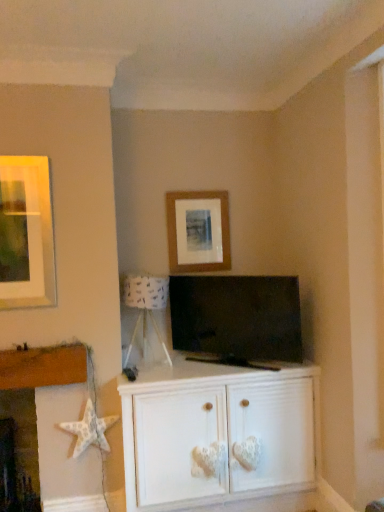
Question: Is white painted wood cabinet at center not within wooden picture frame at center?

Choices:
 (A) no
 (B) yes

Answer: (B)

Question: Does white painted wood cabinet at center have a greater width compared to wooden picture frame at center?

Choices:
 (A) no
 (B) yes

Answer: (B)

Question: Does white painted wood cabinet at center have a lesser width compared to wooden picture frame at center?

Choices:
 (A) yes
 (B) no

Answer: (B)

Question: Does white painted wood cabinet at center have a greater height compared to wooden picture frame at center?

Choices:
 (A) yes
 (B) no

Answer: (A)

Question: Is the depth of white painted wood cabinet at center greater than that of wooden picture frame at center?

Choices:
 (A) yes
 (B) no

Answer: (B)

Question: Is the surface of white painted wood cabinet at center in direct contact with wooden picture frame at center?

Choices:
 (A) no
 (B) yes

Answer: (A)

Question: Is white textured star at lower left shorter than white painted wood cabinet at center?

Choices:
 (A) no
 (B) yes

Answer: (A)

Question: Is white textured star at lower left touching white painted wood cabinet at center?

Choices:
 (A) no
 (B) yes

Answer: (A)

Question: From the image's perspective, is white textured star at lower left on white painted wood cabinet at center?

Choices:
 (A) yes
 (B) no

Answer: (A)

Question: Considering the relative sizes of white textured star at lower left and white painted wood cabinet at center in the image provided, is white textured star at lower left thinner than white painted wood cabinet at center?

Choices:
 (A) yes
 (B) no

Answer: (A)

Question: Considering the relative sizes of white textured star at lower left and white painted wood cabinet at center in the image provided, is white textured star at lower left bigger than white painted wood cabinet at center?

Choices:
 (A) no
 (B) yes

Answer: (A)

Question: Considering the relative sizes of white textured star at lower left and white painted wood cabinet at center in the image provided, is white textured star at lower left smaller than white painted wood cabinet at center?

Choices:
 (A) yes
 (B) no

Answer: (A)

Question: Does matte black tv at center have a greater width compared to wooden picture frame at center?

Choices:
 (A) yes
 (B) no

Answer: (A)